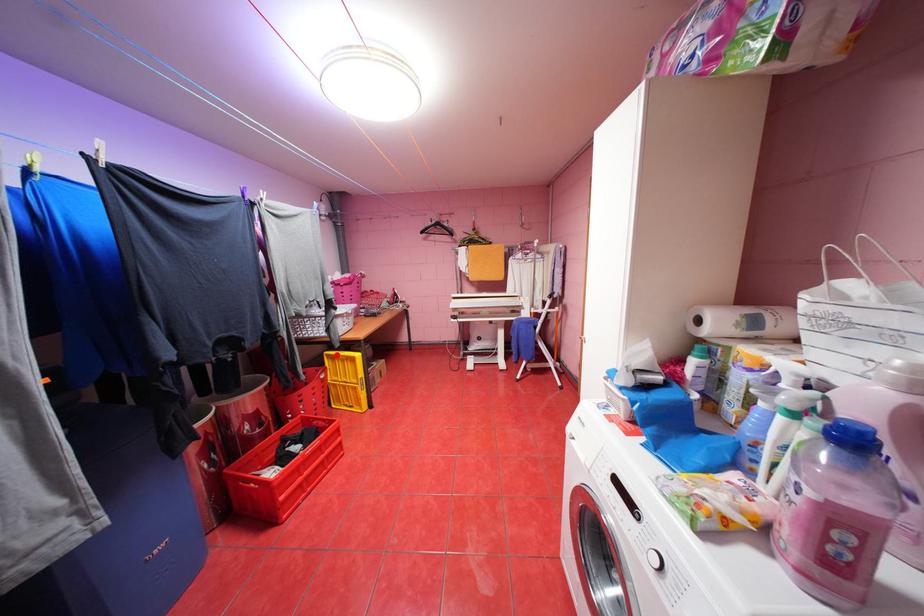
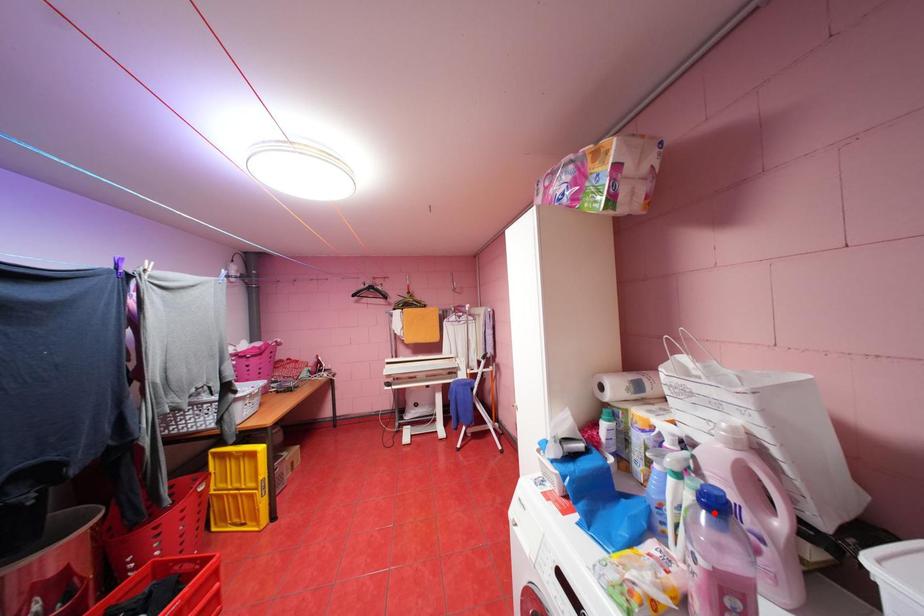
I am providing you with two images of the same scene from different viewpoints. A red point is marked on the first image and another point is marked on the second image. Is the red point in image1 aligned with the point shown in image2?

No